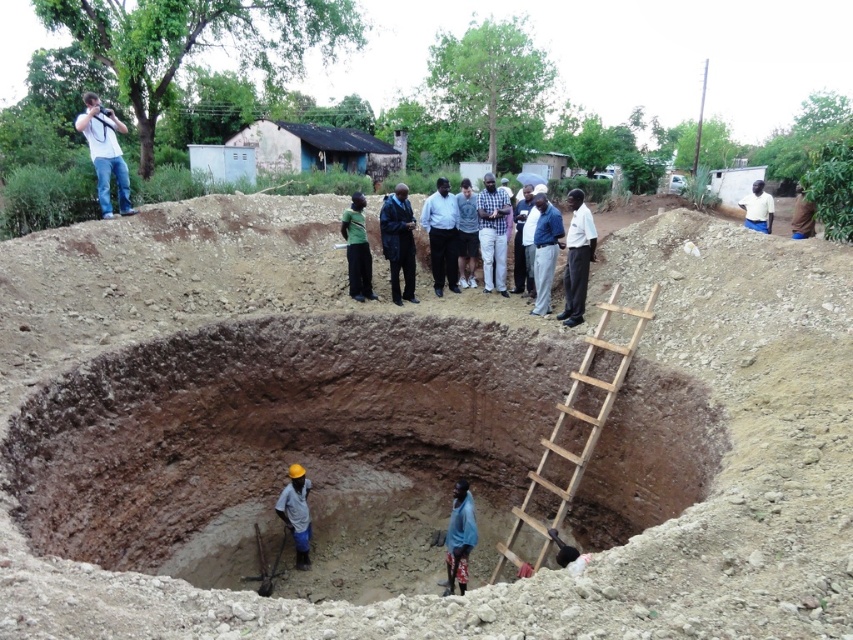
Question: Observing the image, what is the correct spatial positioning of blue fabric at center in reference to green matte shirt at center?

Choices:
 (A) left
 (B) right

Answer: (B)

Question: Can you confirm if green matte shirt at center is positioned above light brown hard hat at lower center?

Choices:
 (A) no
 (B) yes

Answer: (B)

Question: In this image, where is wooden ladder at center located relative to white shirt at upper left?

Choices:
 (A) left
 (B) right

Answer: (B)

Question: Which object is the closest to the light brown hard hat at lower center?

Choices:
 (A) white shirt at upper left
 (B) blue fabric at center

Answer: (B)

Question: Estimate the real-world distances between objects in this image. Which object is farther from the blue fabric at center?

Choices:
 (A) white shirt at upper left
 (B) checkered fabric shirt at center

Answer: (A)

Question: Which point is closer to the camera?

Choices:
 (A) wooden ladder at center
 (B) brown clay pit at center

Answer: (B)